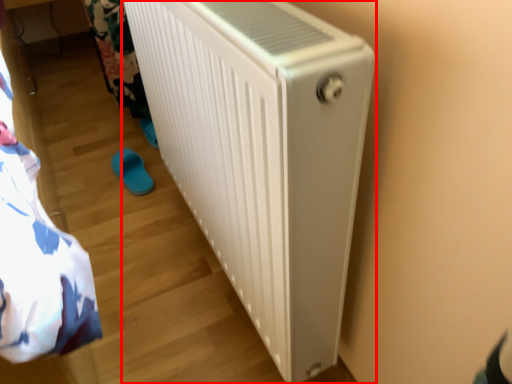
Question: From the image's perspective, considering the relative positions of home appliance (annotated by the red box) and footwear in the image provided, where is home appliance (annotated by the red box) located with respect to the staircase?

Choices:
 (A) above
 (B) below

Answer: (A)